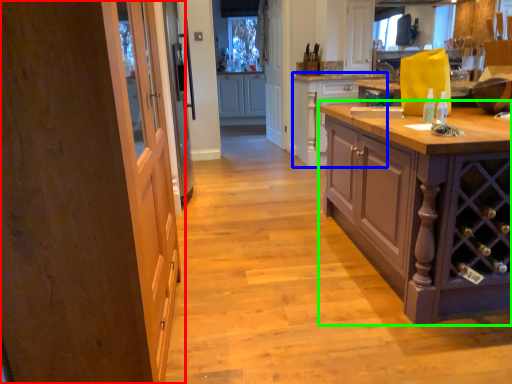
Question: Estimate the real-world distances between objects in this image. Which object is closer to door (highlighted by a red box), cabinetry (highlighted by a blue box) or cabinetry (highlighted by a green box)?

Choices:
 (A) cabinetry
 (B) cabinetry

Answer: (B)